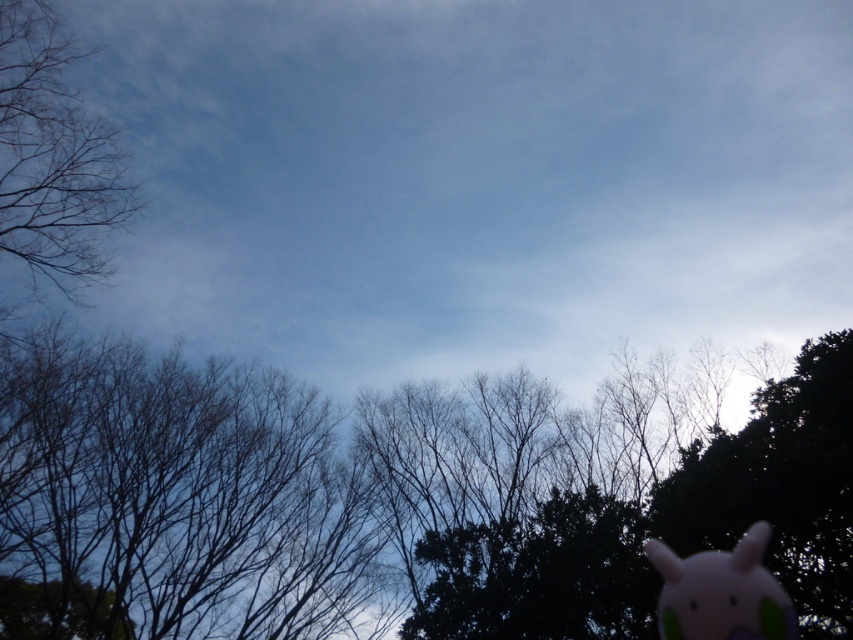
You are standing in the scene and want to place a new decorative item exactly where the green leafy tree at center is located. What are the coordinates you should input into your GPS device to place it there?

The coordinates for the green leafy tree at center are at point (395, 497), so you should input those coordinates into your GPS device to place the new decorative item exactly there.

You are standing in a park and see the green leafy tree at center. If you want to take a photo of it with your smartphone camera, which has a maximum zoom range of 10 meters, will you be able to capture the tree in focus without moving closer?

The green leafy tree at center is 11.69 meters away from you. Since your smartphone camera can only zoom up to 10 meters, you will not be able to capture the tree in focus without moving closer.

You are standing in the scene and want to place a small pink and green toy on the ground near the point marked at coordinates (53, 156). However, you notice that the area around this point is covered with leafless branches. Will the toy be visible from below when placed there?

The point marked at coordinates (53, 156) is on bare branches at left, so placing the toy there would position it under the branches. Since the branches are leafless, the toy would still be visible from below as there are no leaves blocking the view.